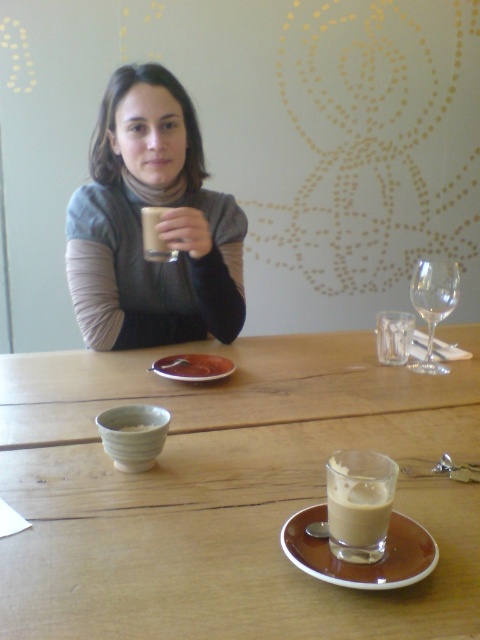
Based on the photo, you are a waiter at the restaurant and need to place a new dessert plate between the brown ceramic saucer at center and the matte ceramic bowl at lower left. Based on their positions, which object should you place the dessert plate closer to?

You should place the dessert plate closer to the matte ceramic bowl at lower left because the brown ceramic saucer at center is closer to you, so the matte ceramic bowl at lower left is farther away, creating space between them where the dessert plate can be placed.

You are a barista trying to place a new order on the table. The matte gray sweater at upper center and the white frothy beverage at center are already there. Can you place a small dessert plate between them without moving either?

The matte gray sweater at upper center is larger in size than the white frothy beverage at center, so there might not be enough space between them to place a small dessert plate without moving either.

You are a customer at this cafe and want to place your phone on the table without blocking the view of the matte gray sweater at upper center. Where should you place it?

Since the matte gray sweater at upper center is located at coordinates approximately 0.358 on the x and 0.333 on the y axis, you should place your phone on the table in an area that does not overlap with these coordinates to ensure the sweater remains visible.